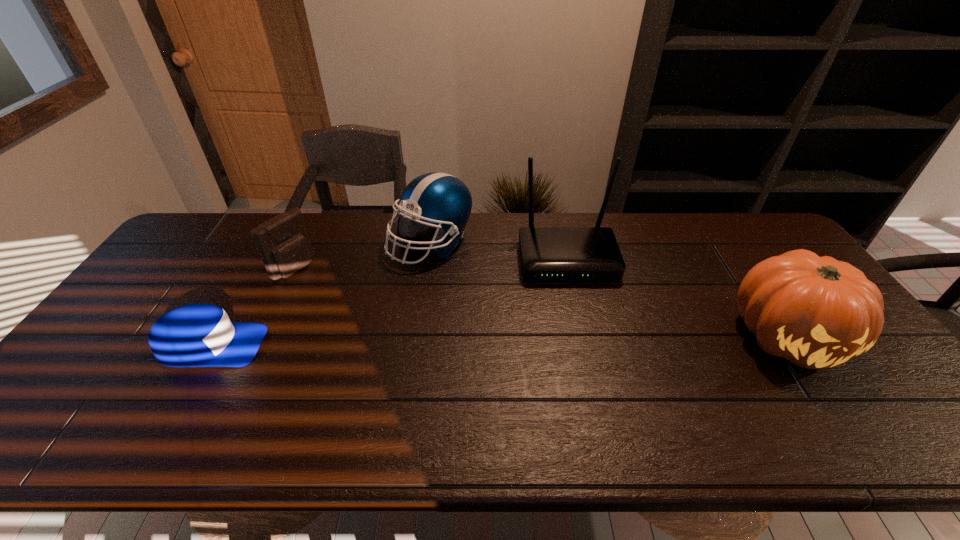
At what (x,y) coordinates should I click in order to perform the action: click on the shortest object. Please return your answer as a coordinate pair (x, y). Looking at the image, I should click on (197, 335).

Locate an element on the screen. Image resolution: width=960 pixels, height=540 pixels. pumpkin is located at coordinates (817, 312).

This screenshot has width=960, height=540. I want to click on the fourth object from left to right, so click(547, 253).

Where is `router`? This screenshot has width=960, height=540. router is located at coordinates (547, 253).

Identify the location of the third object from right to left. (440, 200).

Locate an element on the screen. The height and width of the screenshot is (540, 960). pouch is located at coordinates (283, 242).

At what (x,y) coordinates should I click in order to perform the action: click on free space located on the front-facing side of the shortest object. Please return your answer as a coordinate pair (x, y). This screenshot has width=960, height=540. Looking at the image, I should click on tap(313, 346).

Locate an element on the screen. free space located 0.050m on the carved face of the pumpkin is located at coordinates (832, 404).

What are the coordinates of `free spot located on the front-facing side of the second object from right to left` in the screenshot? It's located at (595, 385).

Where is `vacant space located 0.210m on the front-facing side of the second object from right to left`? The image size is (960, 540). vacant space located 0.210m on the front-facing side of the second object from right to left is located at coordinates (586, 340).